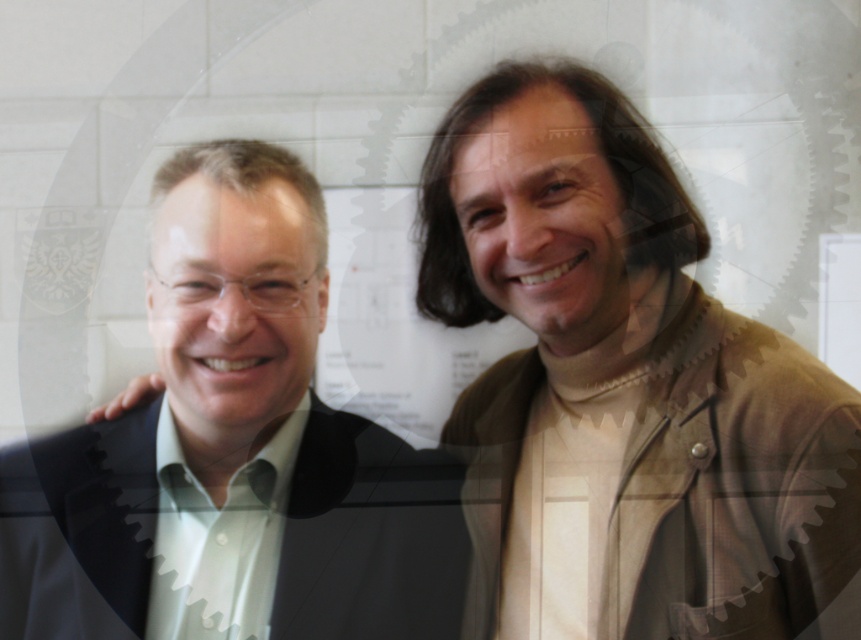
You are a photographer adjusting your camera settings to focus on the subjects. Since both the matte black suit at left and the matte black jacket at right are in the frame, which one should you focus on to ensure the closer object is sharp?

The matte black suit at left is closer to you than the matte black jacket at right, so you should focus on the matte black suit at left to ensure the closer object is sharp.

You are a fashion designer who needs to determine which item is taller between the matte black suit at left and the matte black jacket at right. Based on the scene, which one is taller?

The matte black suit at left is taller than the matte black jacket at right.

You are a photographer adjusting the framing of a group photo. You notice the two subjects wearing the matte black suit at left and the matte black jacket at right. Which clothing item takes up more visual space in the photo?

The matte black jacket at right takes up more visual space than the matte black suit at left because the matte black suit at left occupies less space than matte black jacket at right.